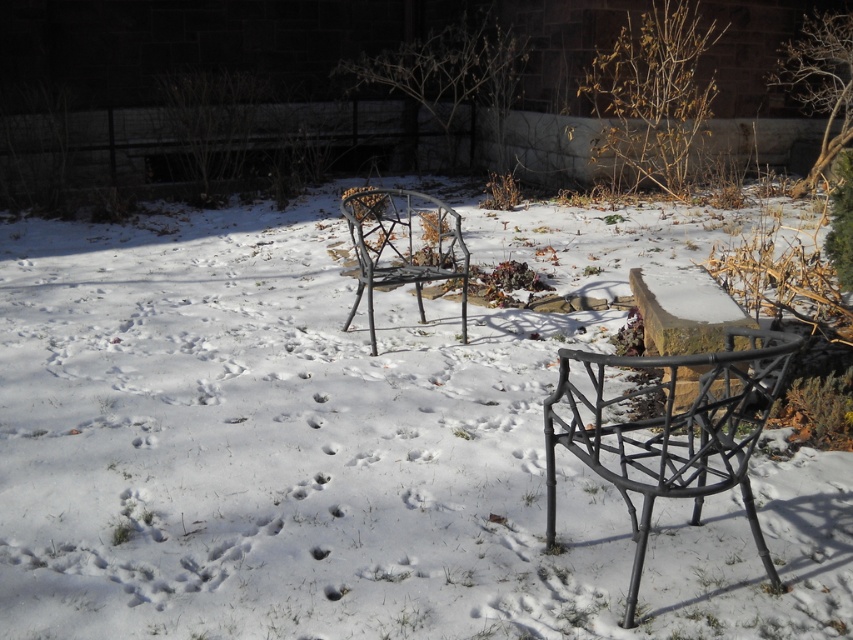
You are a delivery person trying to place a large package between the two chairs in the snowy backyard. The package is 2 meters long. Can you fit the package between the matte black chair at lower right and the other chair?

The two chairs are 2.17 meters apart, so yes, the package which is 2 meters long can fit between the matte black chair at lower right and the other chair since the distance between them is greater than the package length.

You are planning to build a snowman using the white matte snow at center and need to know if there is enough snow available. Considering the size of the metallic wire chair at center, can you determine if the snow at center is sufficient to cover the chair?

The white matte snow at center occupies less space than the metallic wire chair at center, so there is not enough snow to cover the chair.

You are planning to place a small decorative snowman on the white matte snow at center. Considering the space available, will the snowman fit comfortably without overlapping the metallic wire chair at center?

The white matte snow at center might be wider than metallic wire chair at center, so there is likely enough space to place the snowman without overlapping the chair.